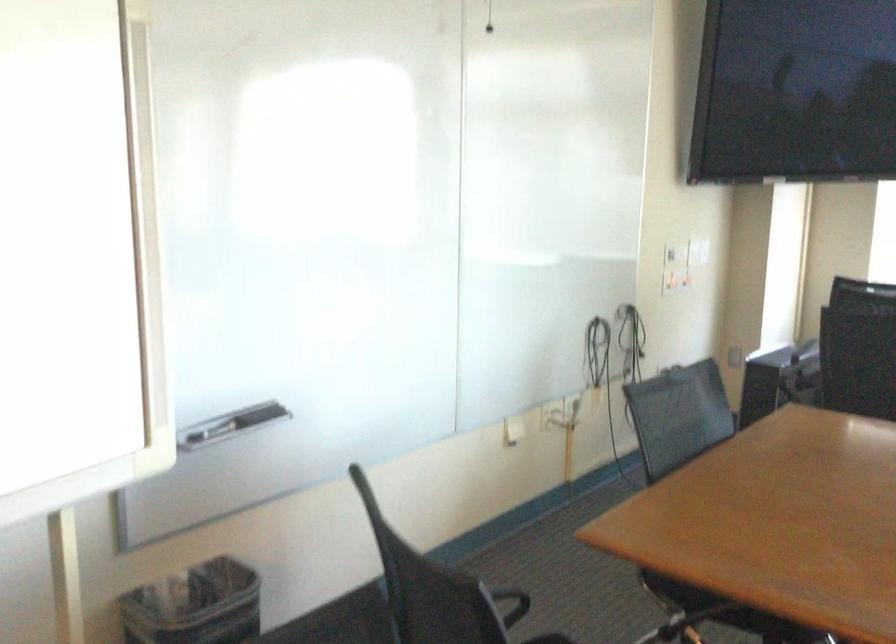
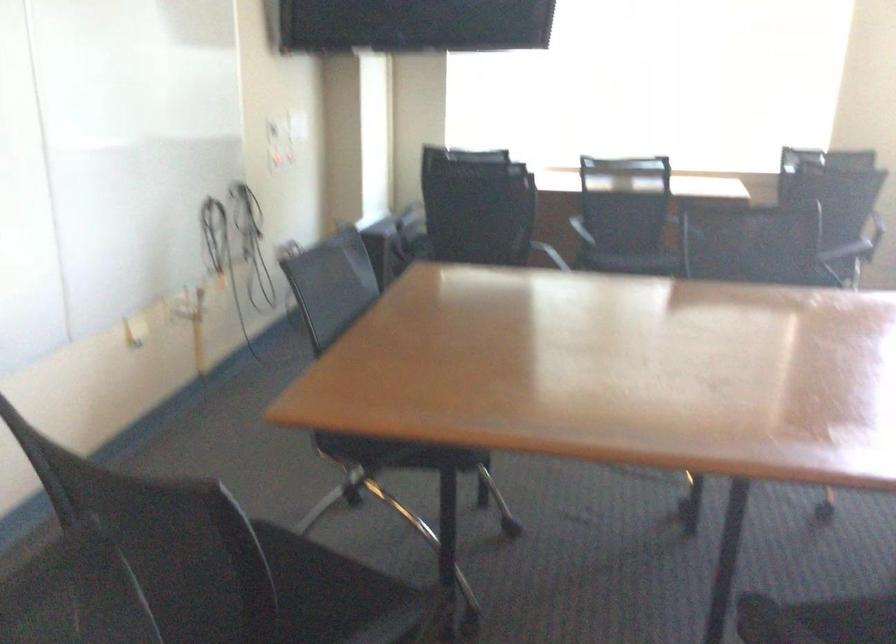
Question: The camera is either moving clockwise (left) or counter-clockwise (right) around the object. The first image is from the beginning of the video and the second image is from the end. Is the camera moving left or right when shooting the video?

Choices:
 (A) Left
 (B) Right

Answer: (A)